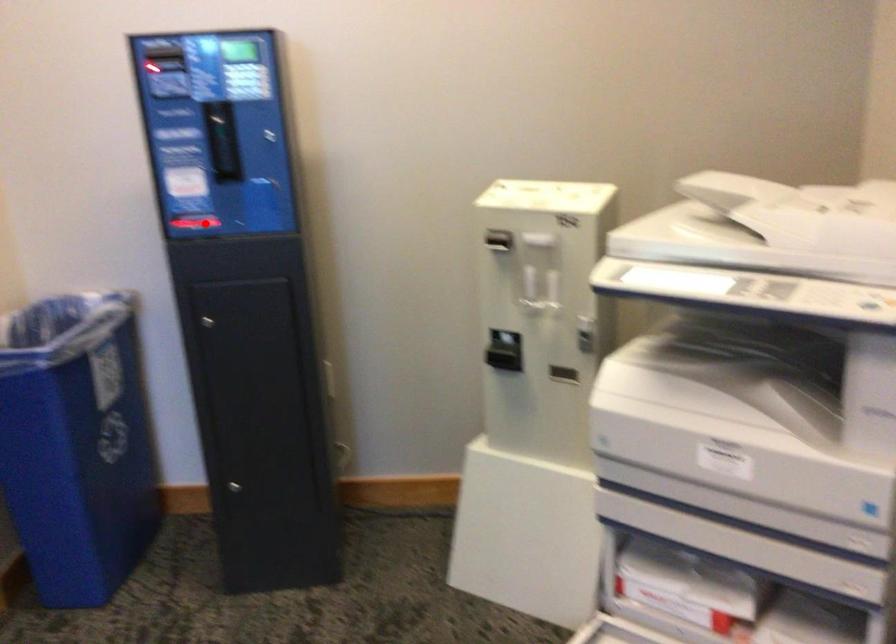
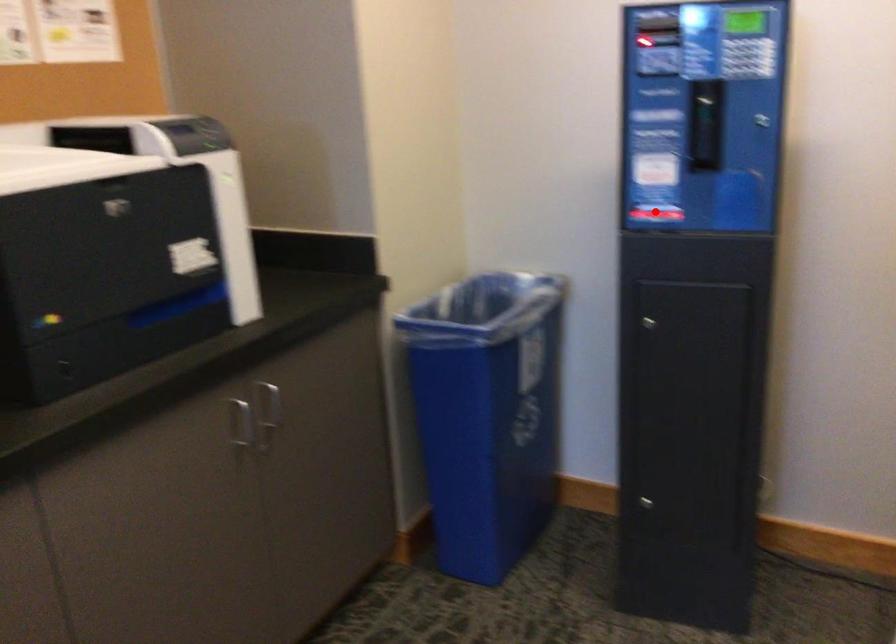
I am providing you with two images of the same scene from different viewpoints. A red point is marked on the first image and another point is marked on the second image. Is the marked point in image1 the same physical position as the marked point in image2?

Yes